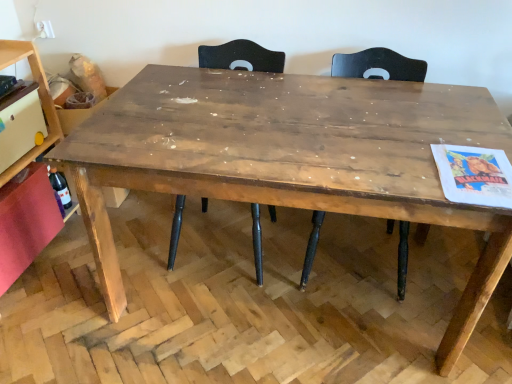
Describe the element at coordinates (291, 158) in the screenshot. I see `rustic wood table at center` at that location.

The image size is (512, 384). What do you see at coordinates (39, 97) in the screenshot?
I see `wooden shelf at left, the 1th shelf in the bottom-to-top sequence` at bounding box center [39, 97].

Locate an element on the screen. dark brown wood chair at center, which is the 2th chair in right-to-left order is located at coordinates (241, 57).

Is matte black chair at upper center, the second chair when ordered from left to right, at the left side of translucent glass bottle at lower left?

Incorrect, matte black chair at upper center, the second chair when ordered from left to right, is not on the left side of translucent glass bottle at lower left.

Is matte black chair at upper center, placed as the 1th chair when sorted from right to left, with translucent glass bottle at lower left?

They are not placed beside each other.

Does matte black chair at upper center, the second chair when ordered from left to right, have a smaller size compared to translucent glass bottle at lower left?

Actually, matte black chair at upper center, the second chair when ordered from left to right, might be larger than translucent glass bottle at lower left.

Which object is thinner, matte black chair at upper center, placed as the 1th chair when sorted from right to left, or translucent glass bottle at lower left?

With smaller width is translucent glass bottle at lower left.

Is point (428, 136) more distant than point (60, 196)?

No, (428, 136) is closer to viewer.

Is rustic wood table at center closer to the viewer compared to translucent glass bottle at lower left?

Yes, rustic wood table at center is closer to the viewer.

Who is smaller, rustic wood table at center or translucent glass bottle at lower left?

Smaller between the two is translucent glass bottle at lower left.

How many degrees apart are the facing directions of rustic wood table at center and translucent glass bottle at lower left?

The angular difference between rustic wood table at center and translucent glass bottle at lower left is 84.7 degrees.

I want to click on chair in front of the dark brown wood chair at center, which is the 2th chair in right-to-left order, so click(378, 65).

Consider the image. From the image's perspective, is matte black chair at upper center, the second chair when ordered from left to right, on top of dark brown wood chair at center, which is the 2th chair in right-to-left order?

No.

Looking at the image, does matte black chair at upper center, placed as the 1th chair when sorted from right to left, seem bigger or smaller compared to dark brown wood chair at center, which is the 2th chair in right-to-left order?

Considering their sizes, matte black chair at upper center, placed as the 1th chair when sorted from right to left, takes up less space than dark brown wood chair at center, which is the 2th chair in right-to-left order.

How different are the orientations of matte black chair at upper center, placed as the 1th chair when sorted from right to left, and dark brown wood chair at center, which is the 2th chair in right-to-left order, in degrees?

The facing directions of matte black chair at upper center, placed as the 1th chair when sorted from right to left, and dark brown wood chair at center, which is the 2th chair in right-to-left order, are 0.00022 degrees apart.

Is wooden shelf at left, acting as the second shelf starting from the top, outside of matte white cabinet at left, marked as the first shelf in a top-to-bottom arrangement?

That's correct, wooden shelf at left, acting as the second shelf starting from the top, is outside of matte white cabinet at left, marked as the first shelf in a top-to-bottom arrangement.

Is point (39, 150) closer to camera compared to point (46, 106)?

No.

Consider the image. Does wooden shelf at left, the 1th shelf in the bottom-to-top sequence, appear on the right side of matte white cabinet at left, the second shelf positioned from the bottom?

In fact, wooden shelf at left, the 1th shelf in the bottom-to-top sequence, is to the left of matte white cabinet at left, the second shelf positioned from the bottom.

Between point (64, 181) and point (236, 52), which one is positioned behind?

The point (64, 181) is more distant.

Are translucent glass bottle at lower left and dark brown wood chair at center, which is the 1th chair from left to right, beside each other?

No, translucent glass bottle at lower left is not with dark brown wood chair at center, which is the 1th chair from left to right.

Considering the sizes of translucent glass bottle at lower left and dark brown wood chair at center, which is the 2th chair in right-to-left order, in the image, is translucent glass bottle at lower left taller or shorter than dark brown wood chair at center, which is the 2th chair in right-to-left order,?

Clearly, translucent glass bottle at lower left is shorter compared to dark brown wood chair at center, which is the 2th chair in right-to-left order.

The image size is (512, 384). Identify the location of shelf above the wooden shelf at left, acting as the second shelf starting from the top (from a real-world perspective). (39, 97).

From a real-world perspective, is matte white cabinet at left, marked as the first shelf in a top-to-bottom arrangement, positioned above or below wooden shelf at left, acting as the second shelf starting from the top?

Clearly, from a real-world perspective, matte white cabinet at left, marked as the first shelf in a top-to-bottom arrangement, is above wooden shelf at left, acting as the second shelf starting from the top.

Is matte white cabinet at left, marked as the first shelf in a top-to-bottom arrangement, facing away from wooden shelf at left, acting as the second shelf starting from the top?

That's right, matte white cabinet at left, marked as the first shelf in a top-to-bottom arrangement, is facing away from wooden shelf at left, acting as the second shelf starting from the top.

Is matte white cabinet at left, marked as the first shelf in a top-to-bottom arrangement, touching wooden shelf at left, the 1th shelf in the bottom-to-top sequence?

Indeed, matte white cabinet at left, marked as the first shelf in a top-to-bottom arrangement, and wooden shelf at left, the 1th shelf in the bottom-to-top sequence, are beside each other and touching.

Does matte black chair at upper center, the second chair when ordered from left to right, turn towards wooden shelf at left, acting as the second shelf starting from the top?

No, matte black chair at upper center, the second chair when ordered from left to right, is not oriented towards wooden shelf at left, acting as the second shelf starting from the top.

Can wooden shelf at left, the 1th shelf in the bottom-to-top sequence, be found inside matte black chair at upper center, the second chair when ordered from left to right?

No, wooden shelf at left, the 1th shelf in the bottom-to-top sequence, is not a part of matte black chair at upper center, the second chair when ordered from left to right.

From a real-world perspective, is matte black chair at upper center, placed as the 1th chair when sorted from right to left, on wooden shelf at left, the 1th shelf in the bottom-to-top sequence?

Actually, matte black chair at upper center, placed as the 1th chair when sorted from right to left, is physically below wooden shelf at left, the 1th shelf in the bottom-to-top sequence, in the real world.

Considering the sizes of objects matte black chair at upper center, placed as the 1th chair when sorted from right to left, and wooden shelf at left, acting as the second shelf starting from the top, in the image provided, who is thinner, matte black chair at upper center, placed as the 1th chair when sorted from right to left, or wooden shelf at left, acting as the second shelf starting from the top,?

wooden shelf at left, acting as the second shelf starting from the top.

Locate an element on the screen. Image resolution: width=512 pixels, height=384 pixels. the 2nd chair to the right when counting from the translucent glass bottle at lower left is located at coordinates (378, 65).

The image size is (512, 384). What are the coordinates of `table in front of the translucent glass bottle at lower left` in the screenshot? It's located at (291, 158).

Which object lies further to the anchor point matte white cabinet at left, marked as the first shelf in a top-to-bottom arrangement, wooden shelf at left, the 1th shelf in the bottom-to-top sequence, or matte black chair at upper center, the second chair when ordered from left to right?

Based on the image, matte black chair at upper center, the second chair when ordered from left to right, appears to be further to matte white cabinet at left, marked as the first shelf in a top-to-bottom arrangement.

Looking at the image, which one is located closer to matte black chair at upper center, the second chair when ordered from left to right, translucent glass bottle at lower left or wooden shelf at left, acting as the second shelf starting from the top?

wooden shelf at left, acting as the second shelf starting from the top.

Estimate the real-world distances between objects in this image. Which object is further from matte black chair at upper center, the second chair when ordered from left to right, dark brown wood chair at center, which is the 2th chair in right-to-left order, or wooden shelf at left, the 1th shelf in the bottom-to-top sequence?

The object further to matte black chair at upper center, the second chair when ordered from left to right, is wooden shelf at left, the 1th shelf in the bottom-to-top sequence.

In the scene shown: Based on their spatial positions, is wooden shelf at left, the 1th shelf in the bottom-to-top sequence, or translucent glass bottle at lower left closer to matte black chair at upper center, the second chair when ordered from left to right?

wooden shelf at left, the 1th shelf in the bottom-to-top sequence, is positioned closer to the anchor matte black chair at upper center, the second chair when ordered from left to right.

From the image, which object appears to be farther from matte white cabinet at left, marked as the first shelf in a top-to-bottom arrangement, translucent glass bottle at lower left or dark brown wood chair at center, which is the 1th chair from left to right?

dark brown wood chair at center, which is the 1th chair from left to right, is positioned further to the anchor matte white cabinet at left, marked as the first shelf in a top-to-bottom arrangement.

Estimate the real-world distances between objects in this image. Which object is further from matte white cabinet at left, the second shelf positioned from the bottom, rustic wood table at center or dark brown wood chair at center, which is the 1th chair from left to right?

Based on the image, rustic wood table at center appears to be further to matte white cabinet at left, the second shelf positioned from the bottom.

When comparing their distances from dark brown wood chair at center, which is the 1th chair from left to right, does matte black chair at upper center, placed as the 1th chair when sorted from right to left, or matte white cabinet at left, marked as the first shelf in a top-to-bottom arrangement, seem closer?

matte black chair at upper center, placed as the 1th chair when sorted from right to left, is positioned closer to the anchor dark brown wood chair at center, which is the 1th chair from left to right.

When comparing their distances from matte black chair at upper center, the second chair when ordered from left to right, does matte white cabinet at left, the second shelf positioned from the bottom, or rustic wood table at center seem further?

matte white cabinet at left, the second shelf positioned from the bottom, lies further to matte black chair at upper center, the second chair when ordered from left to right, than the other object.

Locate an element on the screen. This screenshot has height=384, width=512. bottle between matte white cabinet at left, the second shelf positioned from the bottom, and rustic wood table at center from left to right is located at coordinates (60, 187).

Locate an element on the screen. chair between translucent glass bottle at lower left and matte black chair at upper center, the second chair when ordered from left to right, from left to right is located at coordinates (241, 57).

At what (x,y) coordinates should I click in order to perform the action: click on table between translucent glass bottle at lower left and matte black chair at upper center, the second chair when ordered from left to right, in the horizontal direction. Please return your answer as a coordinate pair (x, y). This screenshot has width=512, height=384. Looking at the image, I should click on (291, 158).

At what (x,y) coordinates should I click in order to perform the action: click on bottle between matte white cabinet at left, marked as the first shelf in a top-to-bottom arrangement, and matte black chair at upper center, placed as the 1th chair when sorted from right to left, in the horizontal direction. Please return your answer as a coordinate pair (x, y). Image resolution: width=512 pixels, height=384 pixels. Looking at the image, I should click on (60, 187).